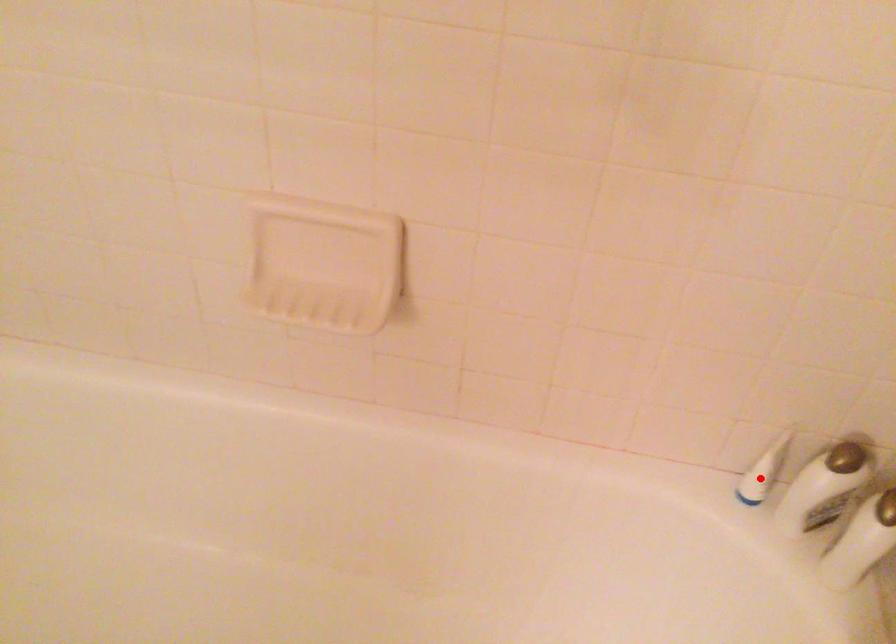
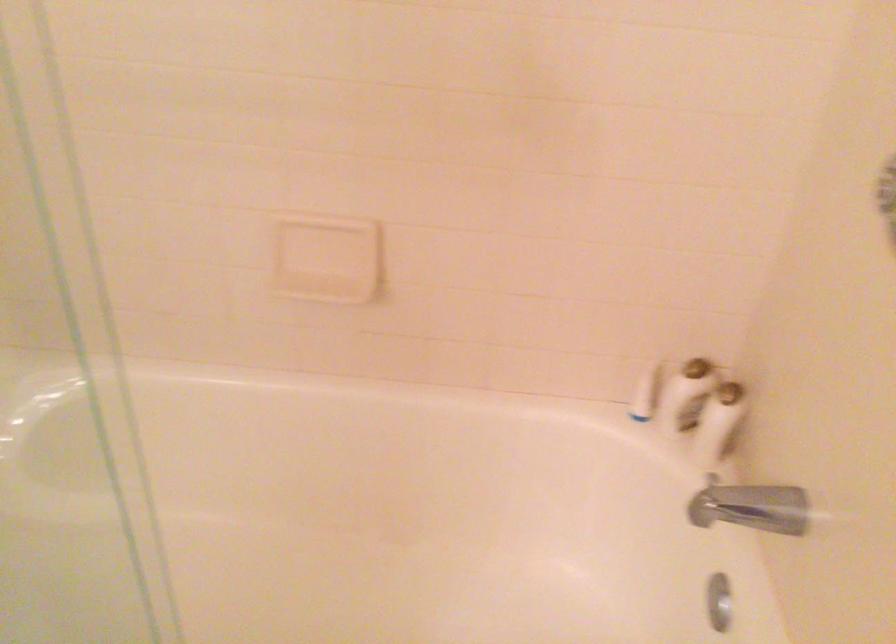
Question: I am providing you with two images of the same scene from different viewpoints. Given a red point in image1, look at the same physical point in image2. Is it:

Choices:
 (A) Closer to the viewpoint
 (B) Farther from the viewpoint

Answer: (B)